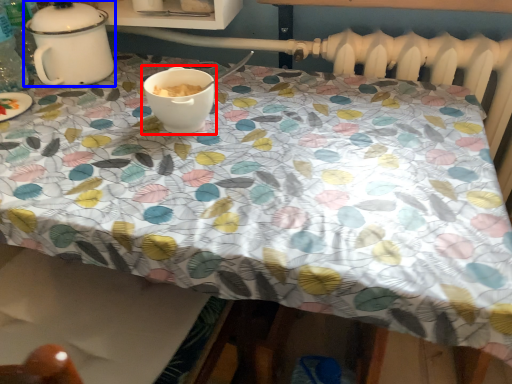
Question: Which point is further to the camera, coffee cup (highlighted by a red box) or tableware (highlighted by a blue box)?

Choices:
 (A) coffee cup
 (B) tableware

Answer: (B)